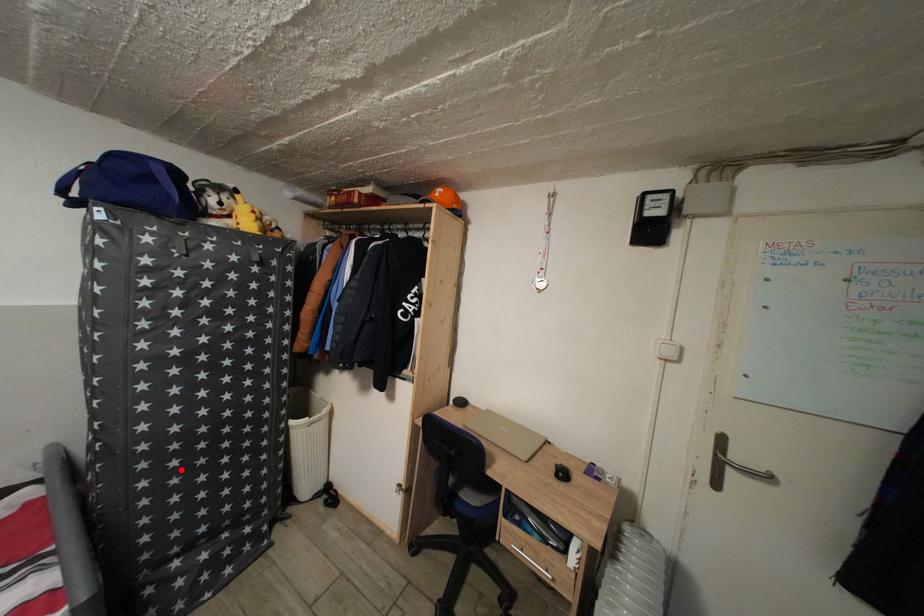
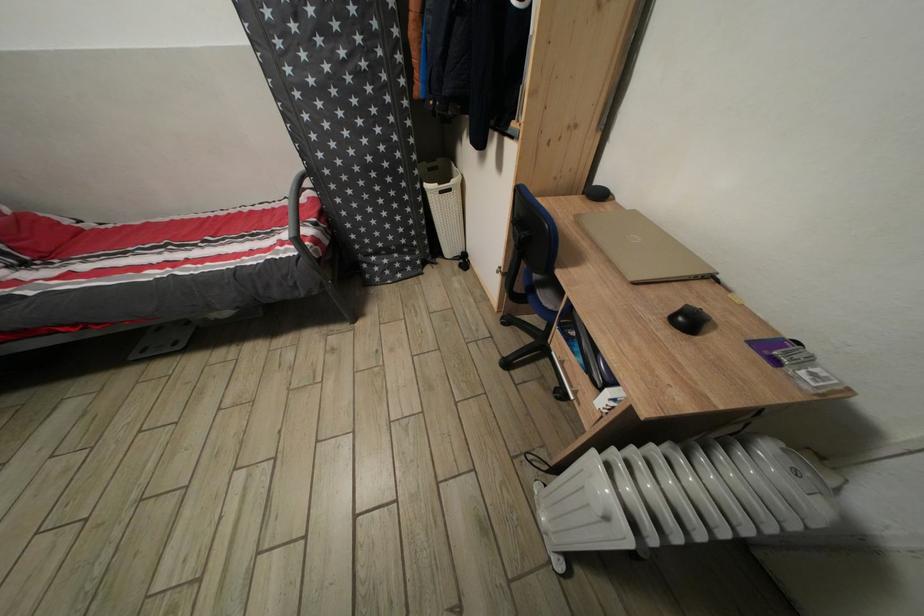
Question: I am providing you with two images of the same scene from different viewpoints. A red point is shown in image1. For the corresponding object point in image2, is it positioned nearer or farther from the camera?

Choices:
 (A) Nearer
 (B) Farther

Answer: (A)